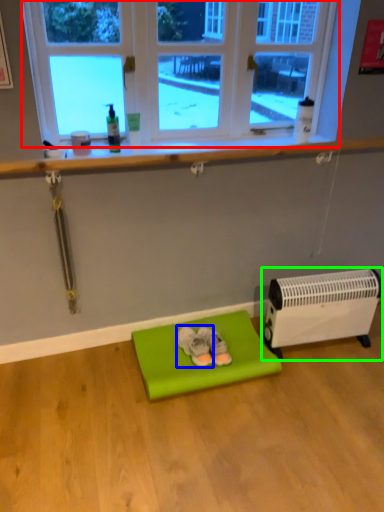
Question: Which is farther away from window (highlighted by a red box)? footwear (highlighted by a blue box) or heater (highlighted by a green box)?

Choices:
 (A) footwear
 (B) heater

Answer: (A)